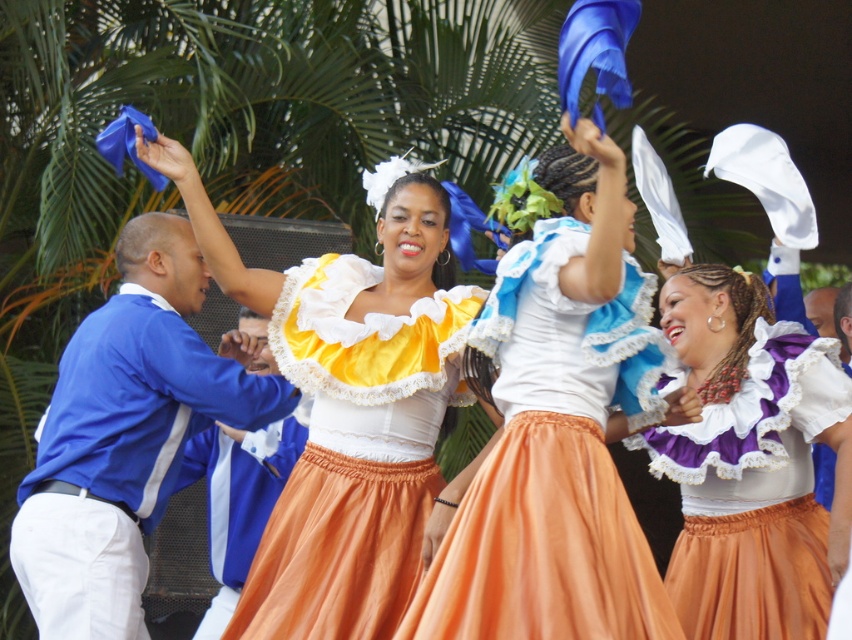
You are a photographer trying to capture the dance performance. You notice the matte orange skirt at center and the yellow satin blouse at center. Which object should you focus on to ensure it fits entirely within your camera frame if the frame can only accommodate one of them?

A: The matte orange skirt at center occupies less space than the yellow satin blouse at center, so focusing on the matte orange skirt at center would ensure it fits entirely within the camera frame.

You are standing at the origin point in the image. Which of the two points, point (x=309, y=262) or point (x=789, y=545), is closer to you?

Point (x=789, y=545) is closer to you because it is in front of point (x=309, y=262).